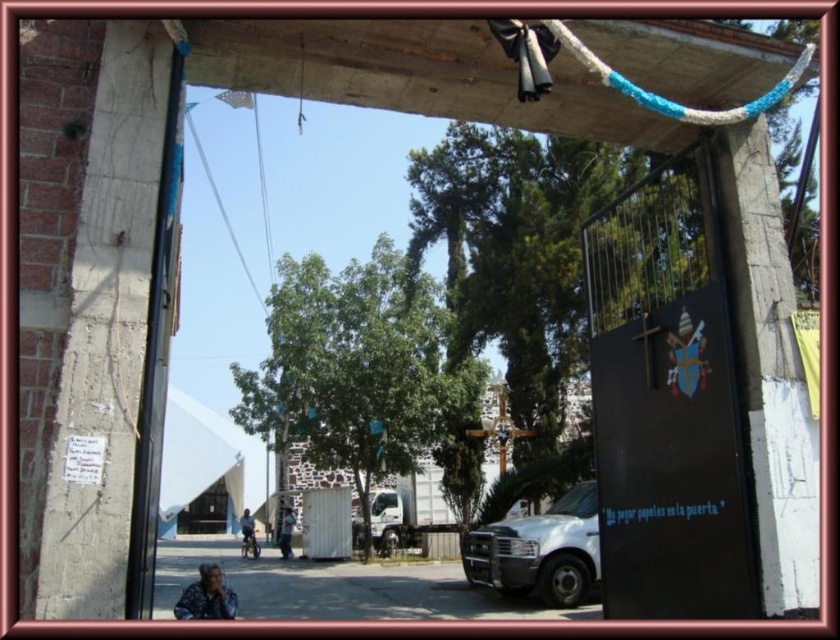
Is point (470, 563) positioned behind point (786, 92)?

Yes, it is behind point (786, 92).

Does white matte van at lower right have a greater height compared to blue braided rope at upper center?

Correct, white matte van at lower right is much taller as blue braided rope at upper center.

Who is more distant from viewer, (580, 486) or (610, 86)?

The point (580, 486) is behind.

What are the coordinates of `white matte van at lower right` in the screenshot? It's located at (539, 550).